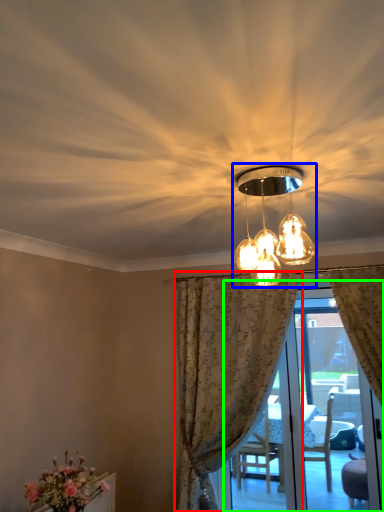
Question: Which is nearer to the curtain (highlighted by a red box)? lamp (highlighted by a blue box) or screen door (highlighted by a green box).

Choices:
 (A) lamp
 (B) screen door

Answer: (B)